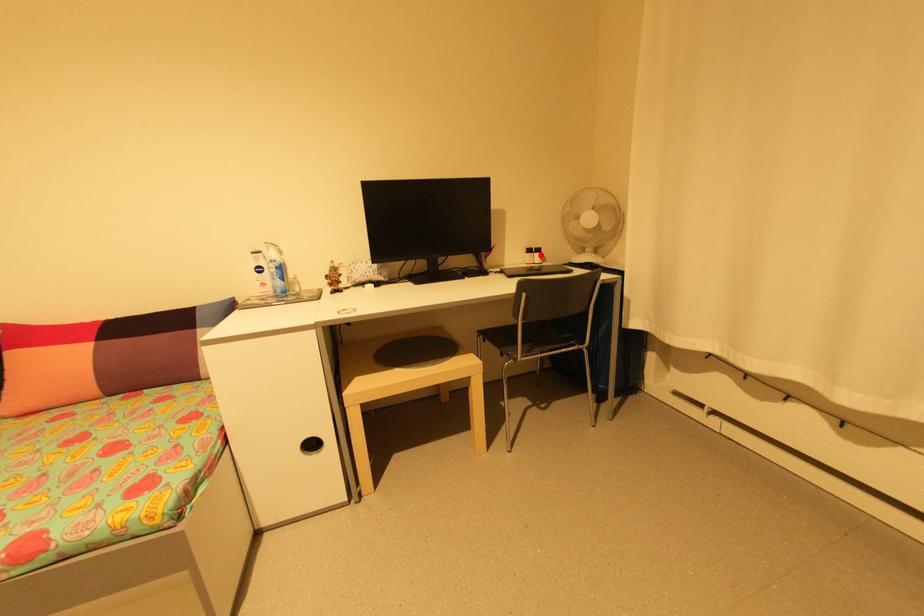
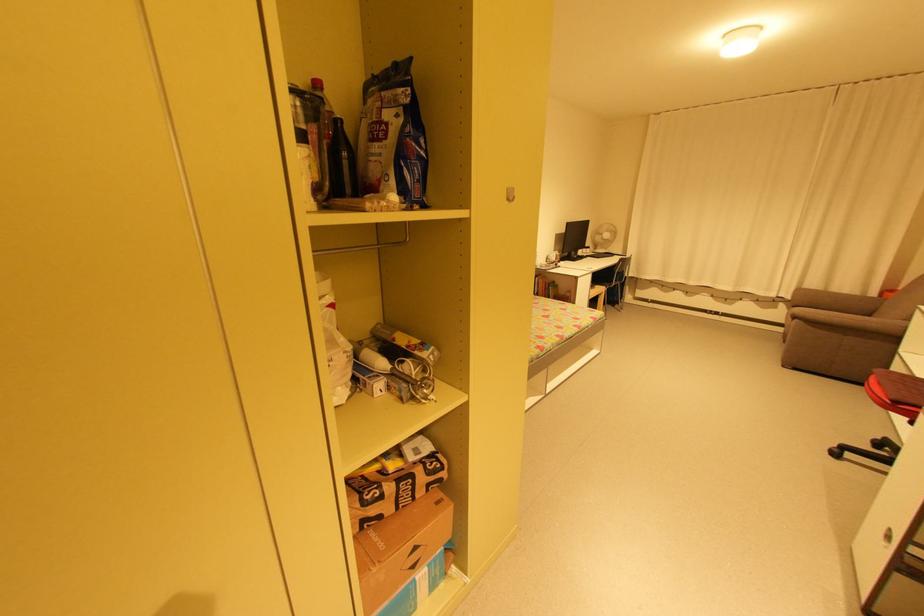
Where in the second image is the point corresponding to the highlighted location from the first image?

(592, 249)